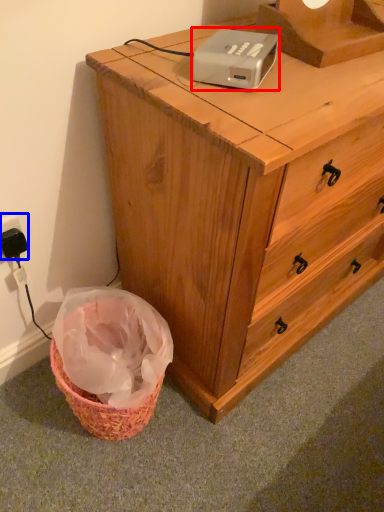
Question: Which object appears farthest to the camera in this image, gadget (highlighted by a red box) or electric outlet (highlighted by a blue box)?

Choices:
 (A) gadget
 (B) electric outlet

Answer: (B)